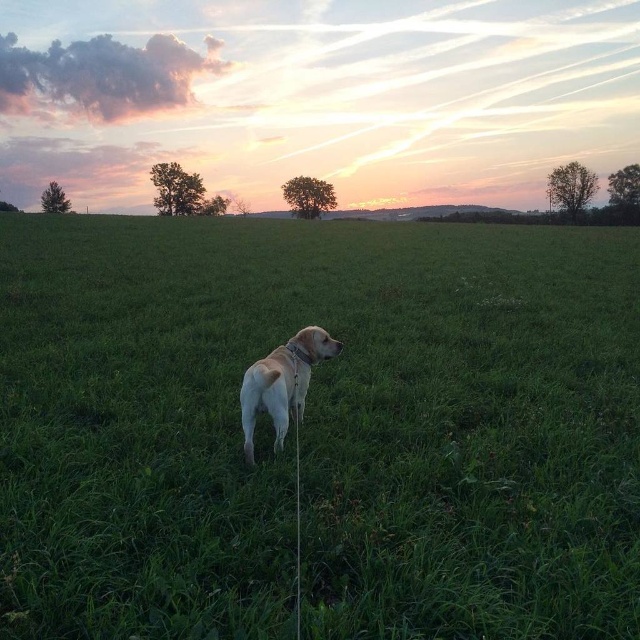
You are a photographer planning to capture the golden Labrador Retriever in the center of the field. The dog is represented by the point at coordinates (317, 429). To ensure the dog is centered in your photo, where should you position your camera relative to the field?

The golden Labrador Retriever is at the center of the field, represented by the point at coordinates (317, 429). To center the dog in the photo, position your camera directly facing the center of the field where the dog is located.

You are a dog owner who wants to ensure your yellow fur dog at center stays within a safe distance from the light yellow fur at center. What is the minimum distance you need to keep between them to prevent them from getting too close?

The minimum distance you need to keep between the yellow fur dog at center and the light yellow fur at center is 4.25 meters to prevent them from getting too close.

You are a photographer trying to capture the golden Labrador Retriever in the scene. You notice two areas of yellow fur at the center. Which one is closer to you, the yellow fur dog at center or the light yellow fur at center?

The yellow fur dog at center is closer to the viewer than the light yellow fur at center.